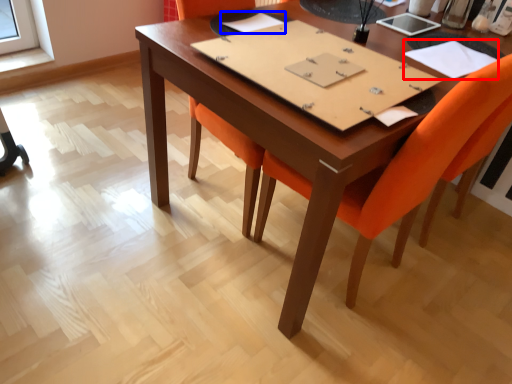
Question: Which object is closer to the camera taking this photo, notebook (highlighted by a red box) or notebook (highlighted by a blue box)?

Choices:
 (A) notebook
 (B) notebook

Answer: (A)